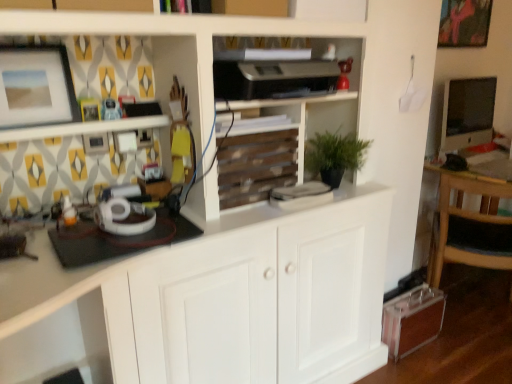
Question: Is matte white picture frame at upper left, which is the first picture frame in bottom-to-top order, wider than wooden slats at center?

Choices:
 (A) yes
 (B) no

Answer: (B)

Question: Does matte white picture frame at upper left, the second picture frame positioned from the right, come behind wooden slats at center?

Choices:
 (A) no
 (B) yes

Answer: (A)

Question: Would you say matte white picture frame at upper left, the second picture frame positioned from the right, contains wooden slats at center?

Choices:
 (A) yes
 (B) no

Answer: (B)

Question: Does matte white picture frame at upper left, arranged as the first picture frame when viewed from the front, have a smaller size compared to wooden slats at center?

Choices:
 (A) no
 (B) yes

Answer: (B)

Question: Is matte white picture frame at upper left, the second picture frame positioned from the right, oriented towards wooden slats at center?

Choices:
 (A) yes
 (B) no

Answer: (B)

Question: Does matte white picture frame at upper left, which is the second picture frame from top to bottom, lie in front of wooden slats at center?

Choices:
 (A) no
 (B) yes

Answer: (B)

Question: Can you confirm if wooden slats at center is bigger than matte pink painting at upper right, the 2th picture frame viewed from the left?

Choices:
 (A) yes
 (B) no

Answer: (A)

Question: From the image's perspective, is wooden slats at center located above matte pink painting at upper right, which ranks as the 1th picture frame in back-to-front order?

Choices:
 (A) no
 (B) yes

Answer: (A)

Question: Considering the relative positions of wooden slats at center and matte pink painting at upper right, the 2th picture frame viewed from the left, in the image provided, is wooden slats at center to the right of matte pink painting at upper right, the 2th picture frame viewed from the left, from the viewer's perspective?

Choices:
 (A) no
 (B) yes

Answer: (A)

Question: Considering the relative sizes of wooden slats at center and matte pink painting at upper right, which appears as the 2th picture frame when viewed from the front, in the image provided, is wooden slats at center taller than matte pink painting at upper right, which appears as the 2th picture frame when viewed from the front,?

Choices:
 (A) yes
 (B) no

Answer: (B)

Question: Is wooden slats at center oriented away from matte pink painting at upper right, the 2th picture frame viewed from the left?

Choices:
 (A) yes
 (B) no

Answer: (B)

Question: Are wooden slats at center and matte pink painting at upper right, which is counted as the 1th picture frame, starting from the top, far apart?

Choices:
 (A) yes
 (B) no

Answer: (A)

Question: Is matte black monitor at right looking in the opposite direction of wooden slats at center?

Choices:
 (A) yes
 (B) no

Answer: (B)